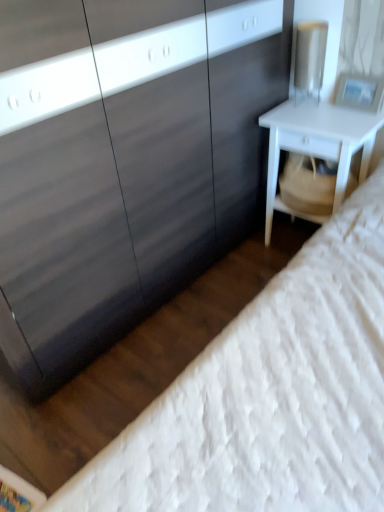
Question: Does matte black dresser at center have a greater height compared to white matte nightstand at right?

Choices:
 (A) yes
 (B) no

Answer: (A)

Question: Is matte black dresser at center positioned before white matte nightstand at right?

Choices:
 (A) no
 (B) yes

Answer: (B)

Question: Considering the relative sizes of matte black dresser at center and white matte nightstand at right in the image provided, is matte black dresser at center wider than white matte nightstand at right?

Choices:
 (A) yes
 (B) no

Answer: (A)

Question: Does matte black dresser at center have a larger size compared to white matte nightstand at right?

Choices:
 (A) no
 (B) yes

Answer: (B)

Question: Considering the relative sizes of matte black dresser at center and white matte nightstand at right in the image provided, is matte black dresser at center thinner than white matte nightstand at right?

Choices:
 (A) no
 (B) yes

Answer: (A)

Question: In terms of size, does white matte nightstand at right appear bigger or smaller than matte black dresser at center?

Choices:
 (A) small
 (B) big

Answer: (A)

Question: Considering the positions of white matte nightstand at right and matte black dresser at center in the image, is white matte nightstand at right wider or thinner than matte black dresser at center?

Choices:
 (A) wide
 (B) thin

Answer: (B)

Question: Relative to matte black dresser at center, is white matte nightstand at right in front or behind?

Choices:
 (A) front
 (B) behind

Answer: (B)

Question: Is white matte nightstand at right inside or outside of matte black dresser at center?

Choices:
 (A) inside
 (B) outside

Answer: (B)

Question: From the image's perspective, is white matte nightstand at right located above or below white textured mattress at lower right?

Choices:
 (A) above
 (B) below

Answer: (A)

Question: Is point (347, 164) closer or farther from the camera than point (331, 322)?

Choices:
 (A) farther
 (B) closer

Answer: (A)

Question: Looking at the image, does white matte nightstand at right seem bigger or smaller compared to white textured mattress at lower right?

Choices:
 (A) big
 (B) small

Answer: (B)

Question: Considering the relative positions of white matte nightstand at right and white textured mattress at lower right in the image provided, is white matte nightstand at right to the left or to the right of white textured mattress at lower right?

Choices:
 (A) right
 (B) left

Answer: (A)

Question: From a real-world perspective, is white textured mattress at lower right physically located above or below white matte nightstand at right?

Choices:
 (A) below
 (B) above

Answer: (B)

Question: In terms of size, does white textured mattress at lower right appear bigger or smaller than white matte nightstand at right?

Choices:
 (A) small
 (B) big

Answer: (B)